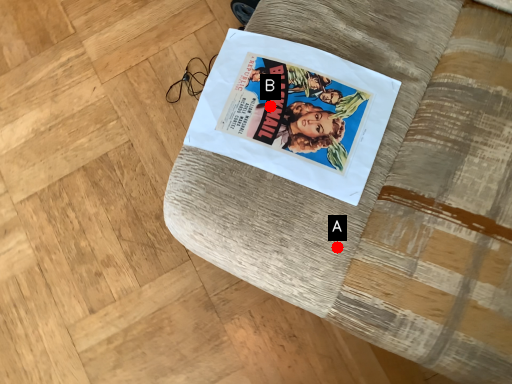
Question: Two points are circled on the image, labeled by A and B beside each circle. Which point is farther from the camera taking this photo?

Choices:
 (A) A is further
 (B) B is further

Answer: (B)